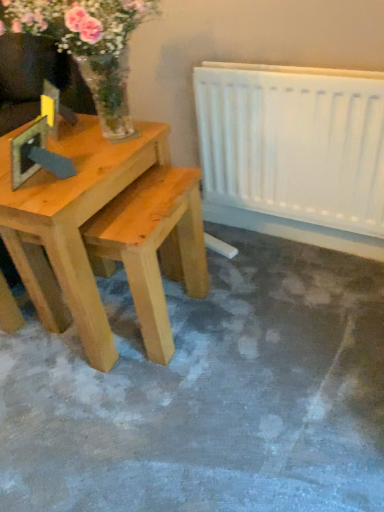
Question: Relative to light brown wood table at left, is white plastic radiator at right in front or behind?

Choices:
 (A) behind
 (B) front

Answer: (A)

Question: Is white plastic radiator at right situated inside light brown wood table at left or outside?

Choices:
 (A) inside
 (B) outside

Answer: (B)

Question: Based on their relative distances, which object is farther from the white plastic radiator at right?

Choices:
 (A) translucent glass vase at upper left
 (B) light brown wood table at left

Answer: (B)

Question: Based on their relative distances, which object is nearer to the translucent glass vase at upper left?

Choices:
 (A) light brown wood table at left
 (B) white plastic radiator at right

Answer: (A)